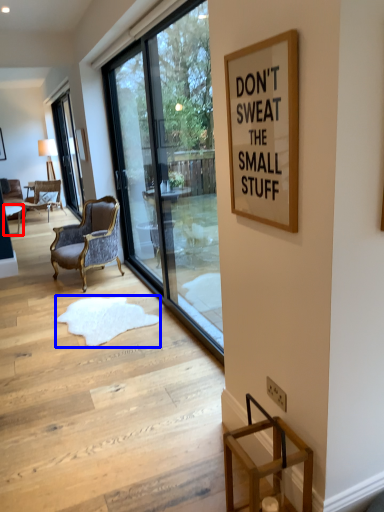
Question: Which object appears closest to the camera in this image, table (highlighted by a red box) or doormat (highlighted by a blue box)?

Choices:
 (A) table
 (B) doormat

Answer: (B)